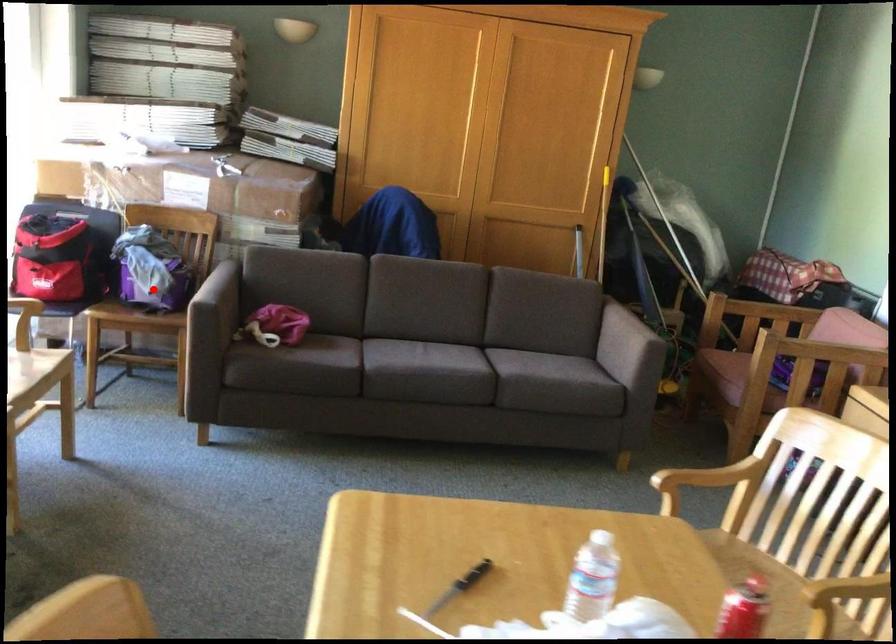
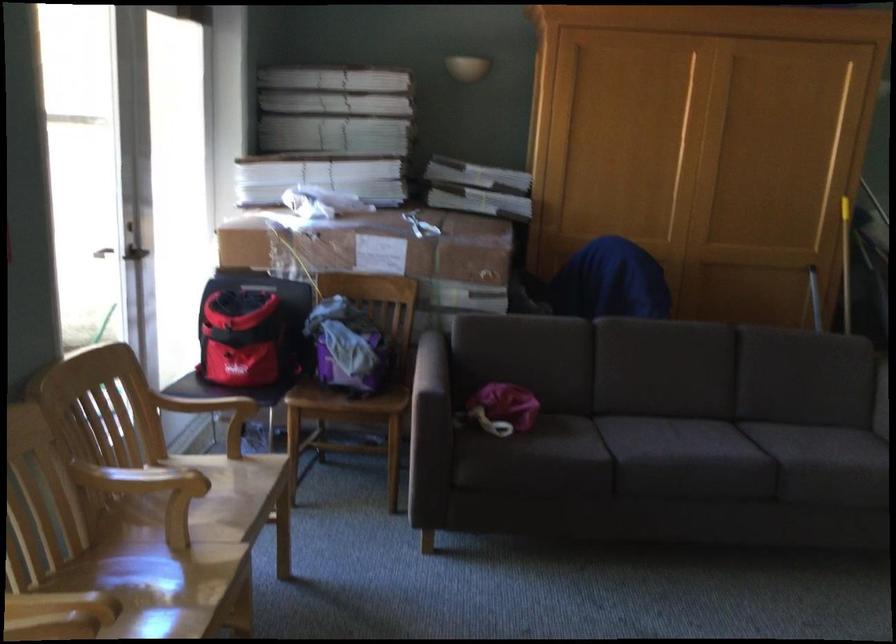
Question: I am providing you with two images of the same scene from different viewpoints. Given a red point in image1, look at the same physical point in image2. Is it:

Choices:
 (A) Closer to the viewpoint
 (B) Farther from the viewpoint

Answer: (A)